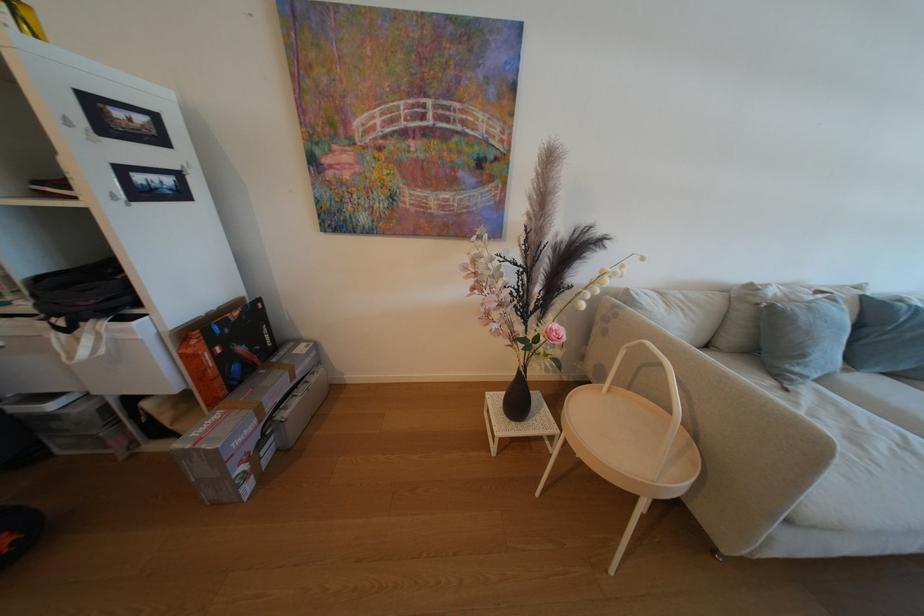
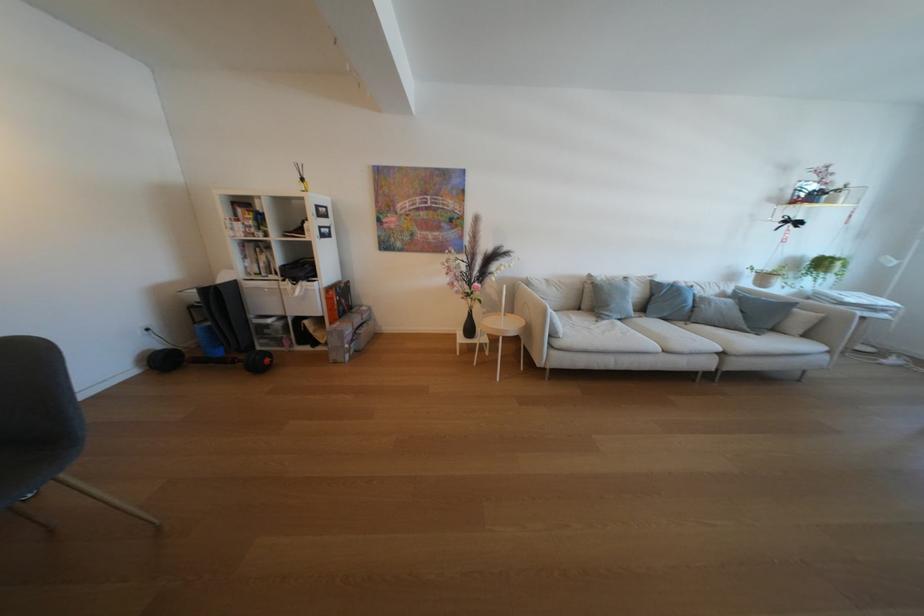
Question: What movement of the cameraman would produce the second image?

Choices:
 (A) Left
 (B) Right
 (C) Forward
 (D) Backward

Answer: (D)